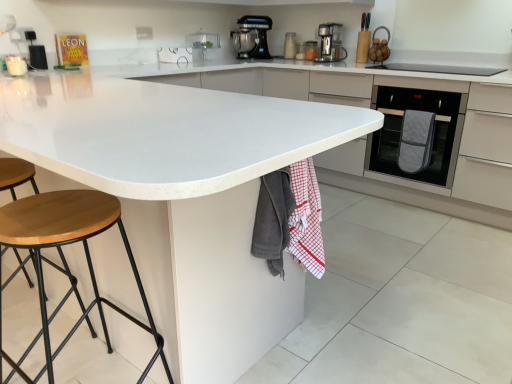
The width and height of the screenshot is (512, 384). I want to click on free location above wooden seat stool at lower left (from a real-world perspective), so (53, 213).